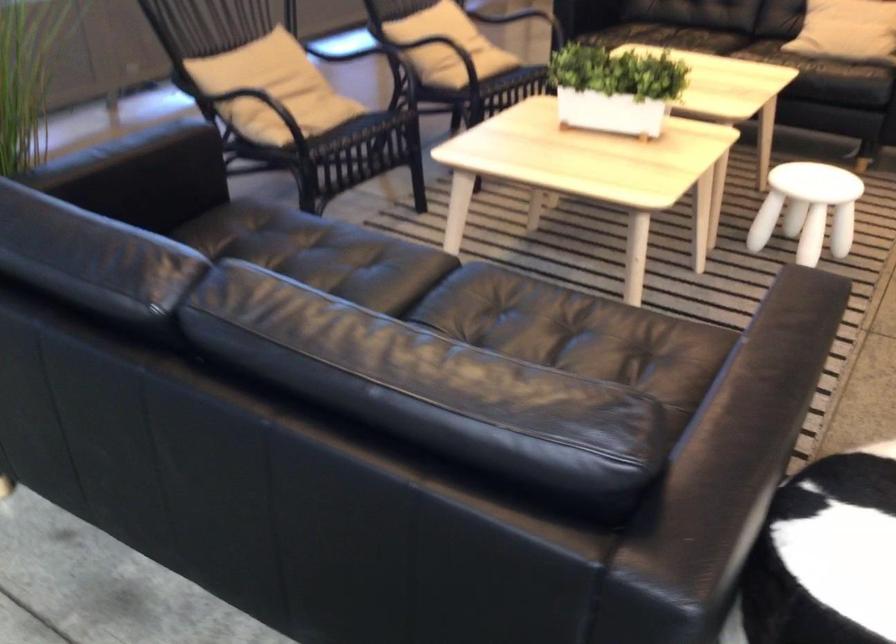
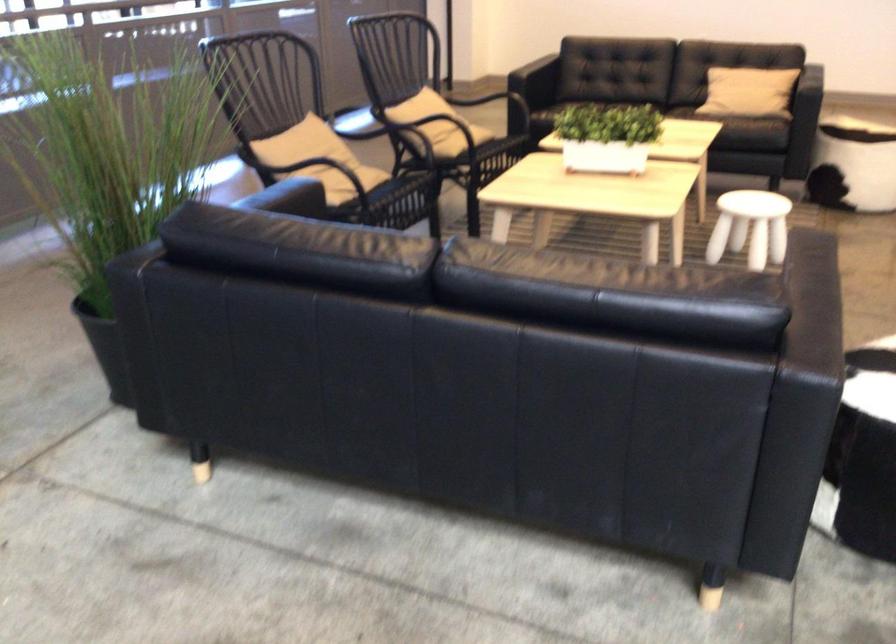
In the second image, find the point that corresponds to pixel 462 73 in the first image.

(462, 140)